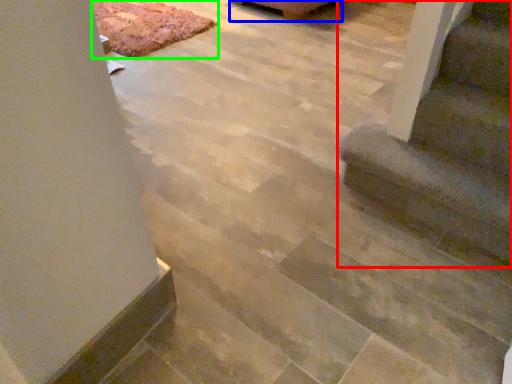
Question: Which is farther away from stairs (highlighted by a red box)? furniture (highlighted by a blue box) or mat (highlighted by a green box)?

Choices:
 (A) furniture
 (B) mat

Answer: (A)